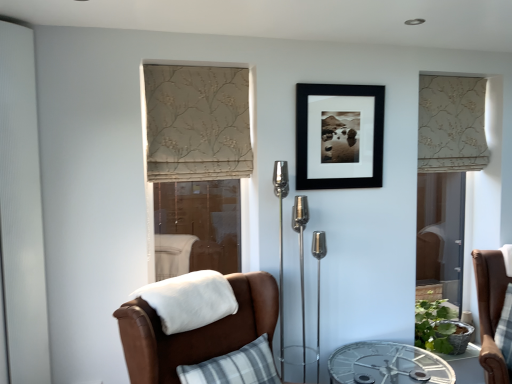
Question: Does point (387, 349) appear closer or farther from the camera than point (437, 220)?

Choices:
 (A) farther
 (B) closer

Answer: (B)

Question: Would you say clear glass table at center is to the left or to the right of clear glass screen door at right, the first screen door positioned from the right, in the picture?

Choices:
 (A) right
 (B) left

Answer: (B)

Question: Estimate the real-world distances between objects in this image. Which object is farther from the clear glass screen door at right, the first screen door positioned from the right?

Choices:
 (A) beige floral fabric curtain at right, which is the 2th curtain in left-to-right order
 (B) white fluffy blanket at lower left
 (C) brown leather chair at right
 (D) white textured screen door at left, placed as the 1th screen door when sorted from front to back
 (E) beige floral fabric curtain at center, marked as the second curtain in a back-to-front arrangement

Answer: (D)

Question: Which is nearer to the white textured screen door at left, arranged as the 3th screen door when viewed from the right?

Choices:
 (A) white fluffy blanket at lower left
 (B) beige floral fabric curtain at right, arranged as the first curtain when viewed from the back
 (C) beige floral fabric curtain at center, which ranks as the first curtain in left-to-right order
 (D) transparent glass screen door at center, marked as the second screen door in a back-to-front arrangement
 (E) black matte picture frame at center

Answer: (A)